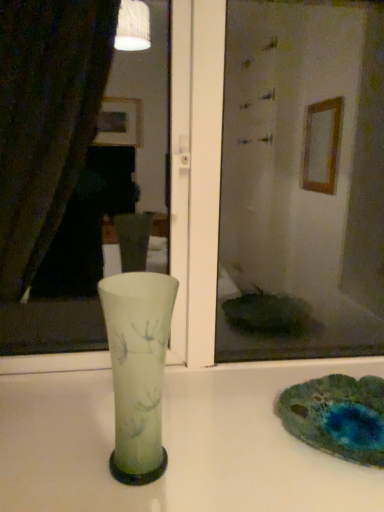
Question: Does transparent glass mirror at center appear on the right side of frosted glass vase at center?

Choices:
 (A) no
 (B) yes

Answer: (B)

Question: From a real-world perspective, is transparent glass mirror at center positioned over frosted glass vase at center based on gravity?

Choices:
 (A) yes
 (B) no

Answer: (A)

Question: From the image's perspective, would you say transparent glass mirror at center is positioned over frosted glass vase at center?

Choices:
 (A) yes
 (B) no

Answer: (A)

Question: Does transparent glass mirror at center have a lesser width compared to frosted glass vase at center?

Choices:
 (A) yes
 (B) no

Answer: (B)

Question: Is transparent glass mirror at center facing towards frosted glass vase at center?

Choices:
 (A) yes
 (B) no

Answer: (A)

Question: Is transparent glass mirror at center to the left or to the right of white glossy vase at center in the image?

Choices:
 (A) right
 (B) left

Answer: (B)

Question: In terms of width, does transparent glass mirror at center look wider or thinner when compared to white glossy vase at center?

Choices:
 (A) thin
 (B) wide

Answer: (A)

Question: From a real-world perspective, relative to white glossy vase at center, is transparent glass mirror at center vertically above or below?

Choices:
 (A) below
 (B) above

Answer: (B)

Question: In terms of height, does transparent glass mirror at center look taller or shorter compared to white glossy vase at center?

Choices:
 (A) short
 (B) tall

Answer: (B)

Question: Is white glossy vase at center bigger or smaller than transparent glass mirror at center?

Choices:
 (A) big
 (B) small

Answer: (B)

Question: Considering the positions of point (64, 403) and point (173, 325), is point (64, 403) closer or farther from the camera than point (173, 325)?

Choices:
 (A) closer
 (B) farther

Answer: (A)

Question: From their relative heights in the image, would you say white glossy vase at center is taller or shorter than transparent glass mirror at center?

Choices:
 (A) short
 (B) tall

Answer: (A)

Question: From a real-world perspective, is white glossy vase at center above or below transparent glass mirror at center?

Choices:
 (A) below
 (B) above

Answer: (A)

Question: In terms of width, does transparent glass mirror at center look wider or thinner when compared to frosted glass vase at center?

Choices:
 (A) thin
 (B) wide

Answer: (B)

Question: Based on their sizes in the image, would you say transparent glass mirror at center is bigger or smaller than frosted glass vase at center?

Choices:
 (A) big
 (B) small

Answer: (A)